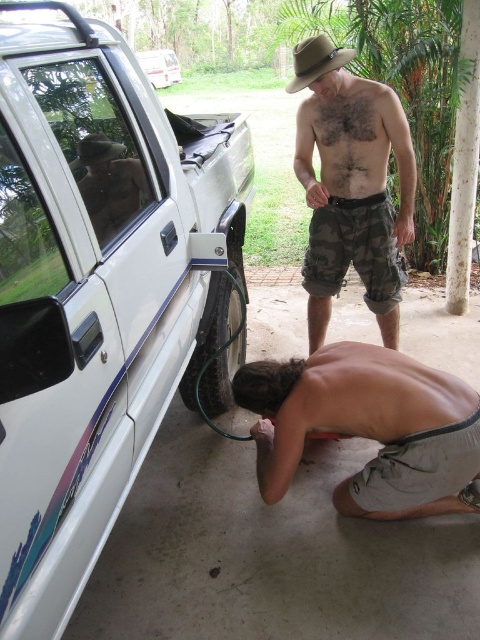
Which is in front, point (216, 308) or point (123, 209)?

Positioned in front is point (123, 209).

Does point (196, 346) lie behind point (96, 173)?

Yes, point (196, 346) is farther from viewer.

Locate an element on the screen. black rubber tire at lower left is located at coordinates (218, 348).

Between camouflage shorts at center and black rubber tire at lower left, which one appears on the left side from the viewer's perspective?

black rubber tire at lower left is more to the left.

Is camouflage shorts at center to the right of black rubber tire at lower left from the viewer's perspective?

Correct, you'll find camouflage shorts at center to the right of black rubber tire at lower left.

Between point (385, 273) and point (222, 333), which one is positioned behind?

Point (385, 273)

Identify the location of camouflage shorts at center. (350, 186).

Is hairy skin at upper center above brown felt fedora at upper center?

No.

Who is more distant from viewer, [374,134] or [312,67]?

The point [374,134] is behind.

Is point (334, 125) farther from viewer compared to point (338, 49)?

Yes, it is.

Image resolution: width=480 pixels, height=640 pixels. I want to click on hairy skin at upper center, so [x=343, y=116].